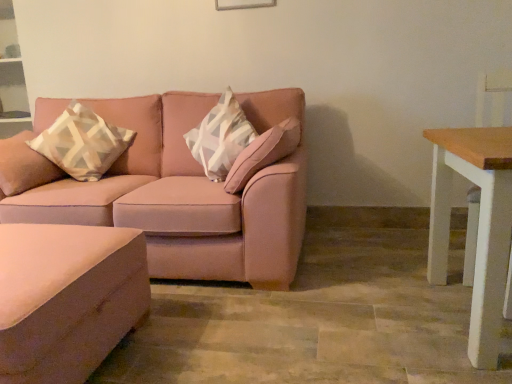
Question: Is wooden white table at right positioned before beige-patterned cushion at left?

Choices:
 (A) no
 (B) yes

Answer: (B)

Question: From the image's perspective, does wooden white table at right appear higher than beige-patterned cushion at left?

Choices:
 (A) no
 (B) yes

Answer: (A)

Question: From the image's perspective, is wooden white table at right located beneath beige-patterned cushion at left?

Choices:
 (A) no
 (B) yes

Answer: (B)

Question: Is wooden white table at right to the left of beige-patterned cushion at left from the viewer's perspective?

Choices:
 (A) no
 (B) yes

Answer: (A)

Question: From a real-world perspective, does wooden white table at right stand above beige-patterned cushion at left?

Choices:
 (A) no
 (B) yes

Answer: (A)

Question: Is matte pink ottoman at lower left to the left or to the right of wooden white table at right in the image?

Choices:
 (A) left
 (B) right

Answer: (A)

Question: Is point [96, 256] positioned closer to the camera than point [453, 170]?

Choices:
 (A) farther
 (B) closer

Answer: (B)

Question: Is matte pink ottoman at lower left in front of or behind wooden white table at right in the image?

Choices:
 (A) front
 (B) behind

Answer: (A)

Question: From a real-world perspective, relative to wooden white table at right, is matte pink ottoman at lower left vertically above or below?

Choices:
 (A) above
 (B) below

Answer: (B)

Question: From the image's perspective, is wooden white table at right located above or below matte pink couch at center?

Choices:
 (A) above
 (B) below

Answer: (B)

Question: Relative to matte pink couch at center, is wooden white table at right in front or behind?

Choices:
 (A) behind
 (B) front

Answer: (B)

Question: In terms of size, does wooden white table at right appear bigger or smaller than matte pink couch at center?

Choices:
 (A) big
 (B) small

Answer: (B)

Question: Do you think wooden white table at right is within matte pink couch at center, or outside of it?

Choices:
 (A) inside
 (B) outside

Answer: (B)

Question: Which is correct: matte pink ottoman at lower left is inside matte pink couch at center, or outside of it?

Choices:
 (A) inside
 (B) outside

Answer: (B)

Question: Looking at their shapes, would you say matte pink ottoman at lower left is wider or thinner than matte pink couch at center?

Choices:
 (A) thin
 (B) wide

Answer: (A)